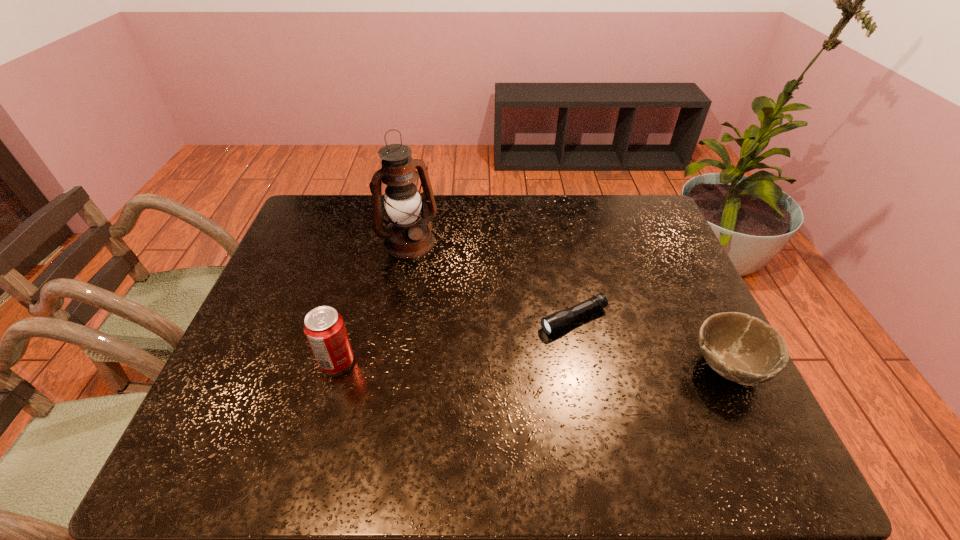
I want to click on vacant space situated 0.110m at the lens end of the third object from left to right, so click(508, 346).

Locate an element on the screen. The width and height of the screenshot is (960, 540). vacant region located at the lens end of the third object from left to right is located at coordinates (461, 368).

Locate an element on the screen. The image size is (960, 540). vacant region located 0.100m on the side of the farthest object, there is a wick adjustment knob is located at coordinates pos(437,275).

In order to click on free space located on the side of the farthest object, there is a wick adjustment knob in this screenshot , I will do (444, 284).

This screenshot has width=960, height=540. What are the coordinates of `free region located on the side of the farthest object, there is a wick adjustment knob` in the screenshot? It's located at (480, 332).

Find the location of a particular element. The width and height of the screenshot is (960, 540). object that is at the far edge is located at coordinates (408, 235).

The image size is (960, 540). Find the location of `object that is at the near edge`. object that is at the near edge is located at coordinates (743, 349).

Image resolution: width=960 pixels, height=540 pixels. I want to click on object at the right edge, so coord(743,349).

Find the location of a particular element. Image resolution: width=960 pixels, height=540 pixels. object at the near right corner is located at coordinates (743, 349).

This screenshot has height=540, width=960. What are the coordinates of `blank space at the far edge of the desktop` in the screenshot? It's located at (580, 212).